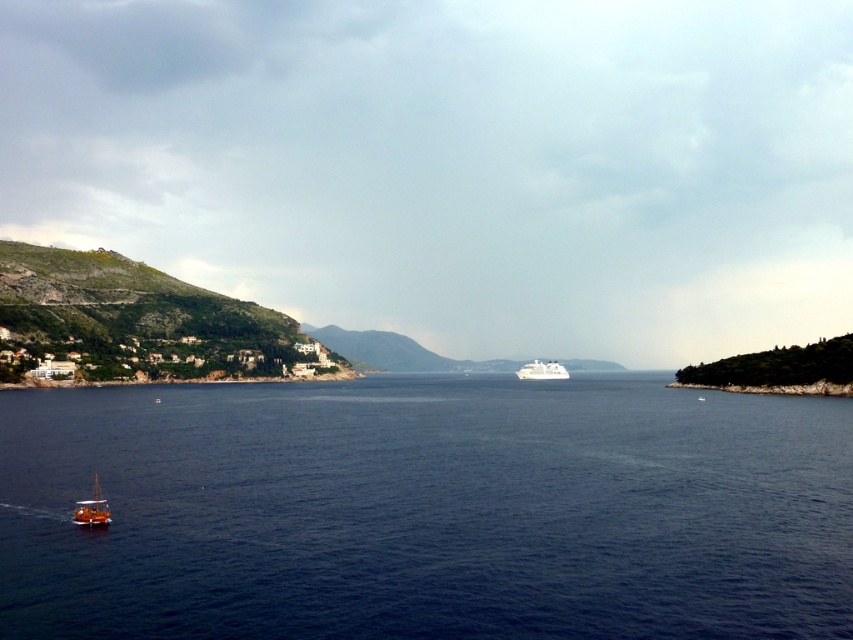
Consider the image. Between wooden sailboat at lower left and white glossy cruise ship at center, which one is positioned higher?

Positioned higher is wooden sailboat at lower left.

Measure the distance between wooden sailboat at lower left and white glossy cruise ship at center.

They are 265.10 meters apart.

Locate an element on the screen. This screenshot has width=853, height=640. wooden sailboat at lower left is located at coordinates (91, 508).

Does blue water at lower left appear on the left side of wooden sailboat at lower left?

No, blue water at lower left is not to the left of wooden sailboat at lower left.

Can you confirm if blue water at lower left is thinner than wooden sailboat at lower left?

Incorrect, blue water at lower left's width is not less than wooden sailboat at lower left's.

Which is behind, point (439, 563) or point (96, 504)?

Point (96, 504)

The height and width of the screenshot is (640, 853). Identify the location of blue water at lower left. (426, 509).

Does blue water at lower left appear on the right side of white glossy cruise ship at center?

Incorrect, blue water at lower left is not on the right side of white glossy cruise ship at center.

Identify the location of blue water at lower left. (426, 509).